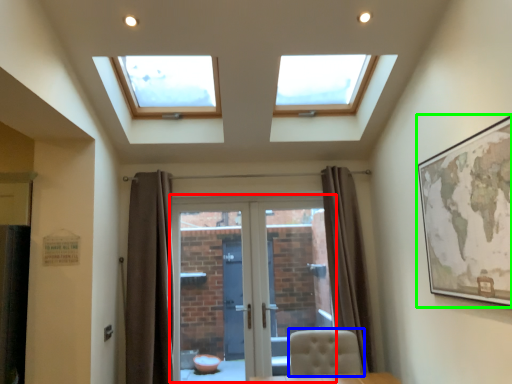
Question: Which object is the farthest from door (highlighted by a red box)? Choose among these: chair (highlighted by a blue box) or picture frame (highlighted by a green box).

Choices:
 (A) chair
 (B) picture frame

Answer: (B)